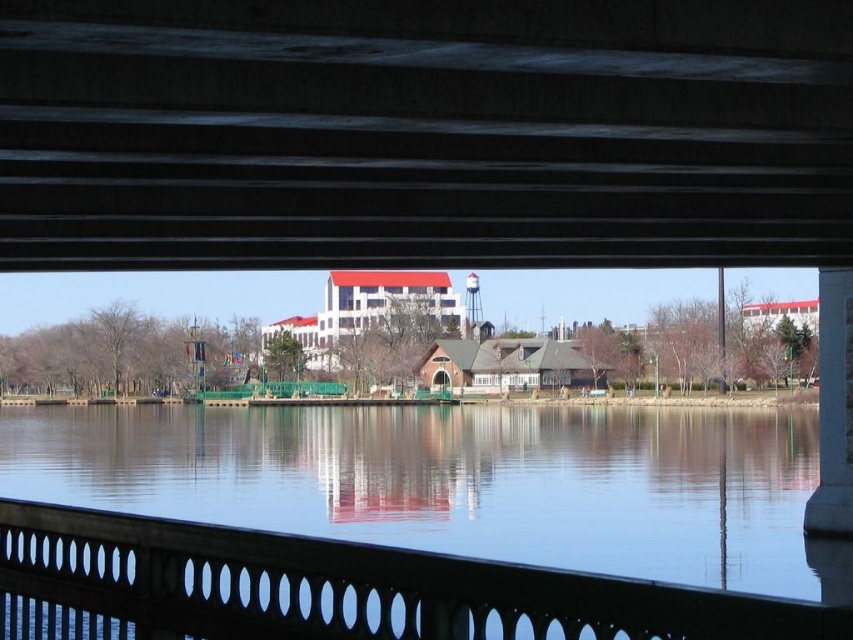
Question: Can you confirm if concrete bridge at upper center is smaller than black metal railing at lower center?

Choices:
 (A) yes
 (B) no

Answer: (B)

Question: Which of the following is the closest to the observer?

Choices:
 (A) (482, 577)
 (B) (567, 67)

Answer: (A)

Question: Which object appears closest to the camera in this image?

Choices:
 (A) black metal railing at lower center
 (B) concrete bridge at upper center

Answer: (A)

Question: Is concrete bridge at upper center bigger than black metal railing at lower center?

Choices:
 (A) no
 (B) yes

Answer: (B)

Question: Does concrete bridge at upper center appear on the right side of black metal railing at lower center?

Choices:
 (A) yes
 (B) no

Answer: (A)